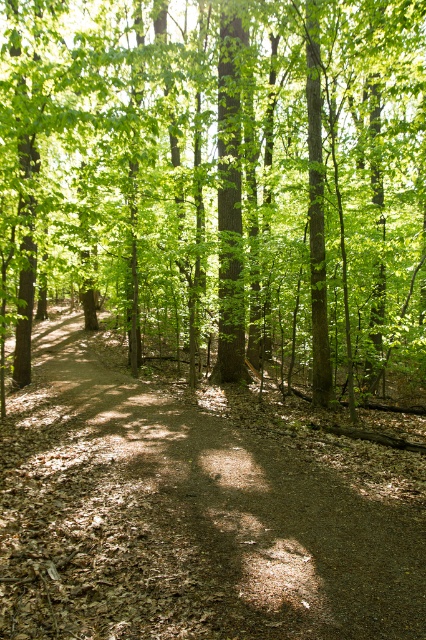
You are standing at the entrance of the forest and see a point marked at coordinates [221,180]. According to the scene, what object is located at that point?

The point at coordinates [221,180] corresponds to the green leafy tree at center.